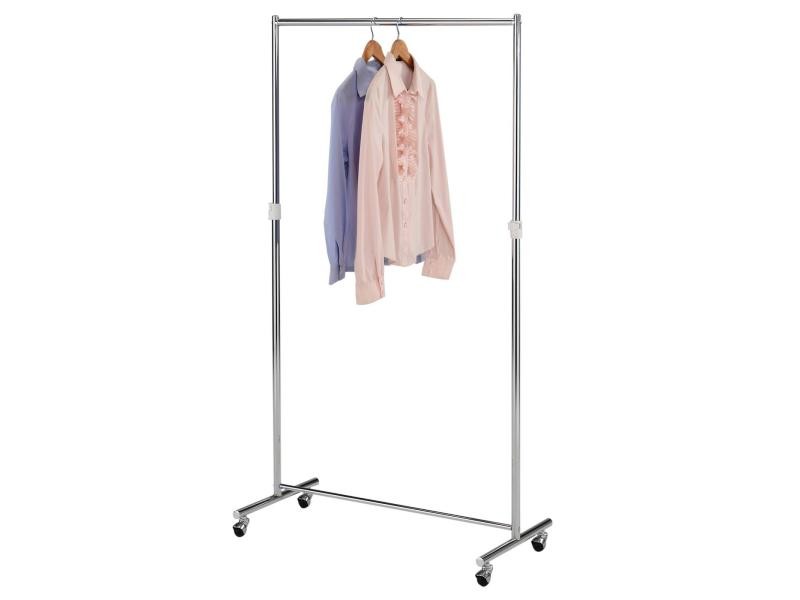
The image size is (800, 600). I want to click on clothing rack wheels, so click(246, 530), click(310, 500), click(493, 573), click(542, 545).